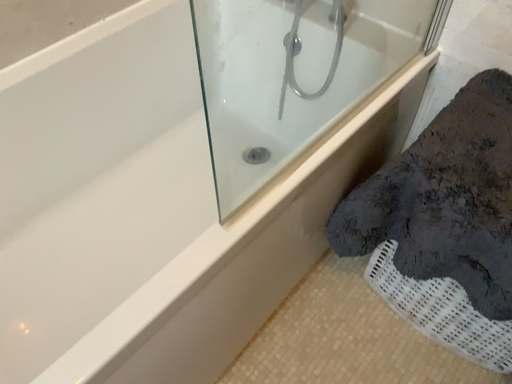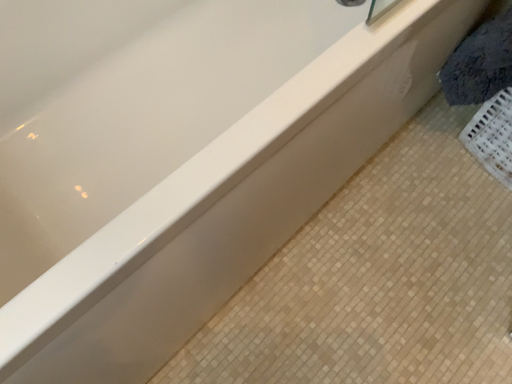
Question: How did the camera likely rotate when shooting the video?

Choices:
 (A) rotated downward
 (B) rotated upward

Answer: (A)